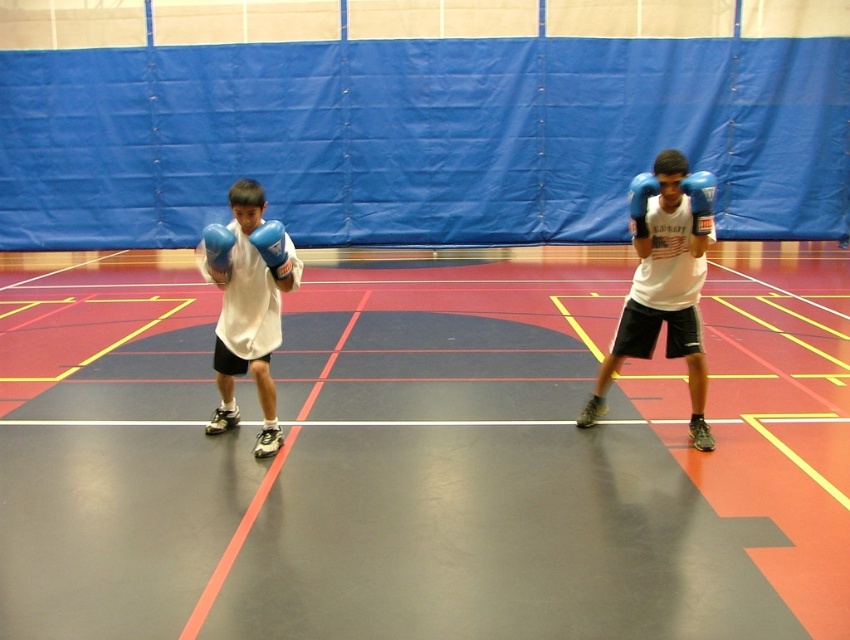
Does blue matte boxing glove at upper right have a lesser width compared to blue synthetic boxing glove at right?

Correct, blue matte boxing glove at upper right's width is less than blue synthetic boxing glove at right's.

Looking at this image, between blue matte boxing glove at upper right and blue synthetic boxing glove at right, which one is positioned lower?

Positioned lower is blue matte boxing glove at upper right.

Does point (703, 186) come in front of point (630, 195)?

That is True.

Identify the location of blue matte boxing glove at upper right. (700, 198).

Does blue matte boxing glove at upper center have a lesser height compared to blue synthetic boxing glove at right?

Correct, blue matte boxing glove at upper center is not as tall as blue synthetic boxing glove at right.

Does blue matte boxing glove at upper center appear on the right side of blue synthetic boxing glove at right?

Incorrect, blue matte boxing glove at upper center is not on the right side of blue synthetic boxing glove at right.

The width and height of the screenshot is (850, 640). Find the location of `blue matte boxing glove at upper center`. blue matte boxing glove at upper center is located at coordinates (272, 248).

Is matte blue gloves at center wider than white matte shirt at left?

Yes, matte blue gloves at center is wider than white matte shirt at left.

Who is more forward, (649, 348) or (251, 278)?

Point (251, 278) is more forward.

The image size is (850, 640). Describe the element at coordinates (664, 282) in the screenshot. I see `matte blue gloves at center` at that location.

You are a GUI agent. You are given a task and a screenshot of the screen. Output one action in this format:
    pyautogui.click(x=<x>, y=<y>)
    Task: Click on the matte blue gloves at center
    This screenshot has width=850, height=640.
    Given the screenshot: What is the action you would take?
    point(664,282)